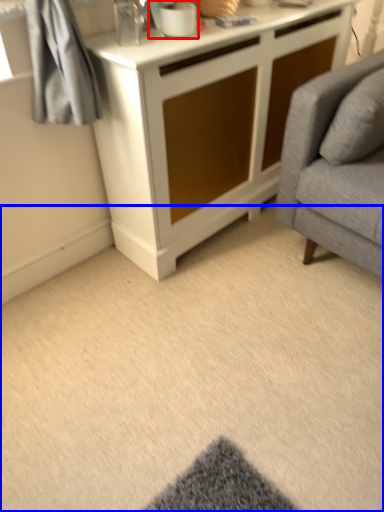
Question: Which point is closer to the camera, appliance (highlighted by a red box) or plain (highlighted by a blue box)?

Choices:
 (A) appliance
 (B) plain

Answer: (B)